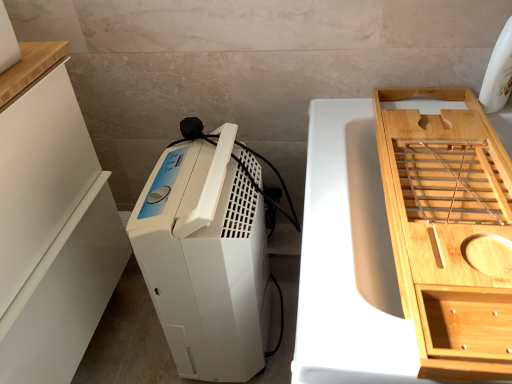
Question: Is white plastic dehumidifier at center positioned with its back to bamboo tray at right?

Choices:
 (A) yes
 (B) no

Answer: (B)

Question: Is white plastic dehumidifier at center to the right of bamboo tray at right from the viewer's perspective?

Choices:
 (A) no
 (B) yes

Answer: (A)

Question: Does white plastic dehumidifier at center have a greater height compared to bamboo tray at right?

Choices:
 (A) yes
 (B) no

Answer: (A)

Question: Can you confirm if white plastic dehumidifier at center is shorter than bamboo tray at right?

Choices:
 (A) yes
 (B) no

Answer: (B)

Question: From a real-world perspective, is white plastic dehumidifier at center located higher than bamboo tray at right?

Choices:
 (A) no
 (B) yes

Answer: (B)

Question: Is white plastic dehumidifier at center further to camera compared to bamboo tray at right?

Choices:
 (A) no
 (B) yes

Answer: (B)

Question: Considering the relative sizes of white matte cabinet at left, which is counted as the second cabinetry, starting from the right, and bamboo tray at right in the image provided, is white matte cabinet at left, which is counted as the second cabinetry, starting from the right, shorter than bamboo tray at right?

Choices:
 (A) yes
 (B) no

Answer: (B)

Question: Can you confirm if white matte cabinet at left, acting as the 1th cabinetry starting from the left, is wider than bamboo tray at right?

Choices:
 (A) no
 (B) yes

Answer: (A)

Question: From the image's perspective, is white matte cabinet at left, which is counted as the second cabinetry, starting from the right, beneath bamboo tray at right?

Choices:
 (A) yes
 (B) no

Answer: (B)

Question: Is white matte cabinet at left, acting as the 1th cabinetry starting from the left, further to the viewer compared to bamboo tray at right?

Choices:
 (A) yes
 (B) no

Answer: (A)

Question: Can you confirm if white matte cabinet at left, acting as the 1th cabinetry starting from the left, is bigger than bamboo tray at right?

Choices:
 (A) no
 (B) yes

Answer: (B)

Question: Can you confirm if white matte cabinet at left, acting as the 1th cabinetry starting from the left, is positioned to the left of bamboo tray at right?

Choices:
 (A) yes
 (B) no

Answer: (A)

Question: Is white matte cabinet at left, which is counted as the second cabinetry, starting from the right, at the right side of light wood/texture bamboo tray at right, which ranks as the 2th cabinetry in left-to-right order?

Choices:
 (A) yes
 (B) no

Answer: (B)